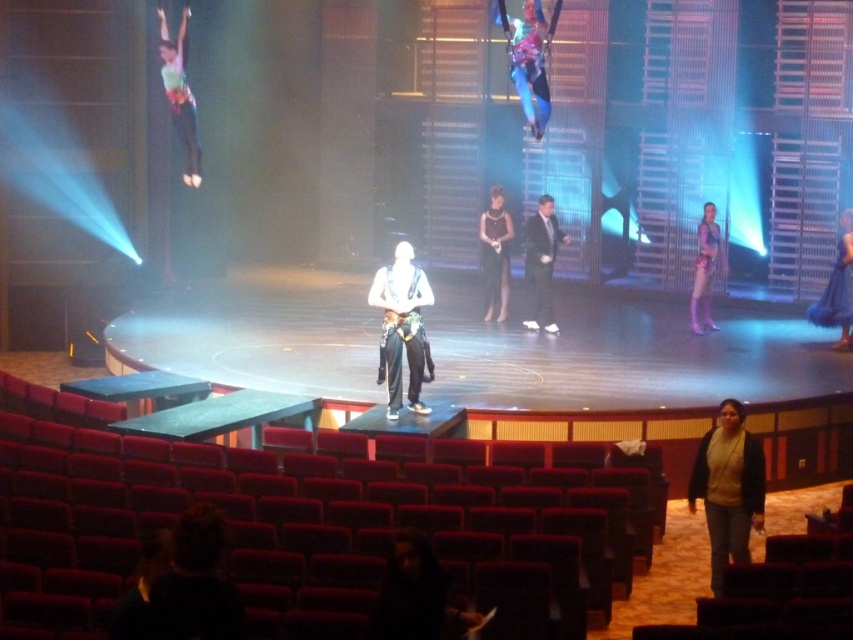
You are an audience member sitting in the front row of the theater. You notice two elements on the stage backdrop. The shiny metallic costume at upper center and the matte green fabric at upper left. Which one do you see closer to you?

The shiny metallic costume at upper center is in front of the matte green fabric at upper left, so you see the shiny metallic costume at upper center closer to you.

You are a stagehand standing at the center of the stage. You need to place a new prop at the point marked as point (728, 486). Where should you place the prop?

The point (728, 486) corresponds to jeans at lower right, so you should place the prop at the jeans at lower right.